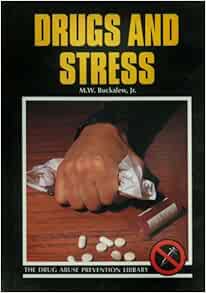
In order to click on pill bottle in this screenshot , I will do `click(162, 212)`.